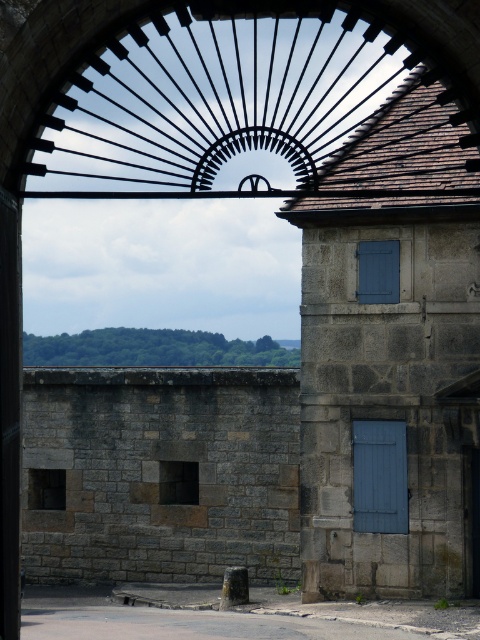
Question: Which point is closer to the camera?

Choices:
 (A) (479, 541)
 (B) (384, 476)
 (C) (339, 163)

Answer: (C)

Question: Among these points, which one is farthest from the camera?

Choices:
 (A) (372, 513)
 (B) (416, 134)

Answer: (A)

Question: Is black iron gate at upper center closer to the viewer compared to wooden door at right?

Choices:
 (A) no
 (B) yes

Answer: (B)

Question: Does black iron gate at upper center have a smaller size compared to wooden door at right?

Choices:
 (A) yes
 (B) no

Answer: (B)

Question: Is blue wooden door at center positioned at the back of wooden door at right?

Choices:
 (A) no
 (B) yes

Answer: (B)

Question: Which object appears closest to the camera in this image?

Choices:
 (A) wooden door at right
 (B) black iron gate at upper center

Answer: (B)